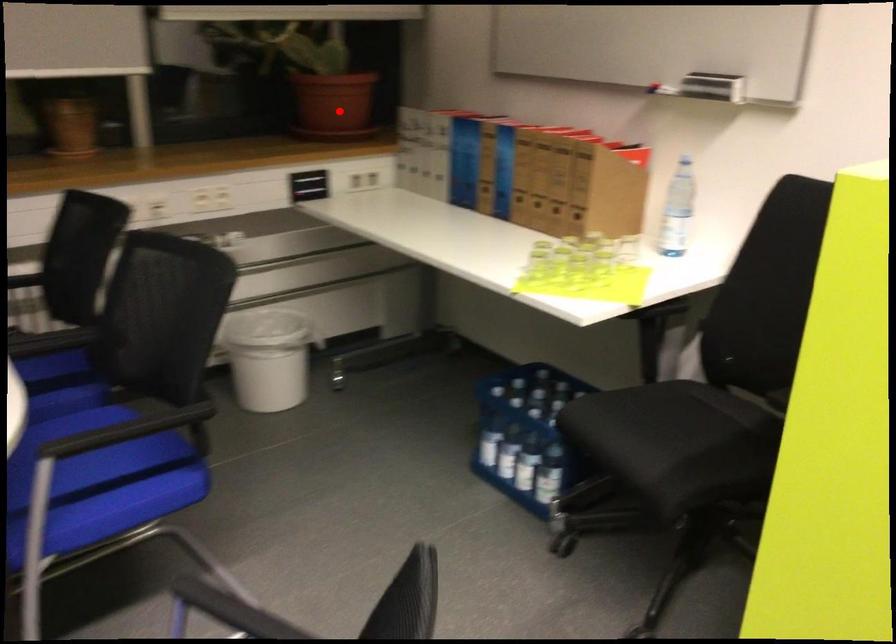
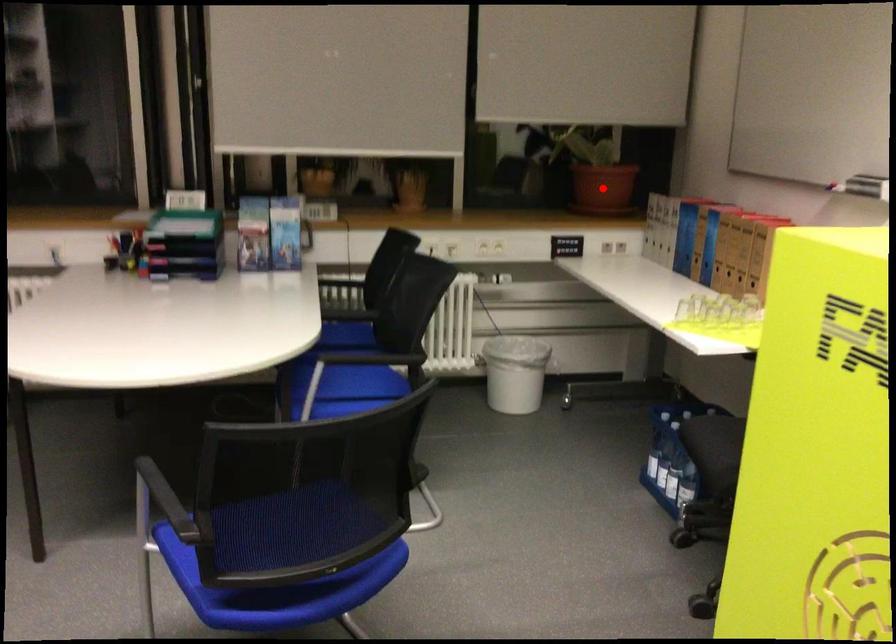
I am providing you with two images of the same scene from different viewpoints. A red point is marked on the first image and another point is marked on the second image. Are the points marked in image1 and image2 representing the same 3D position?

Yes